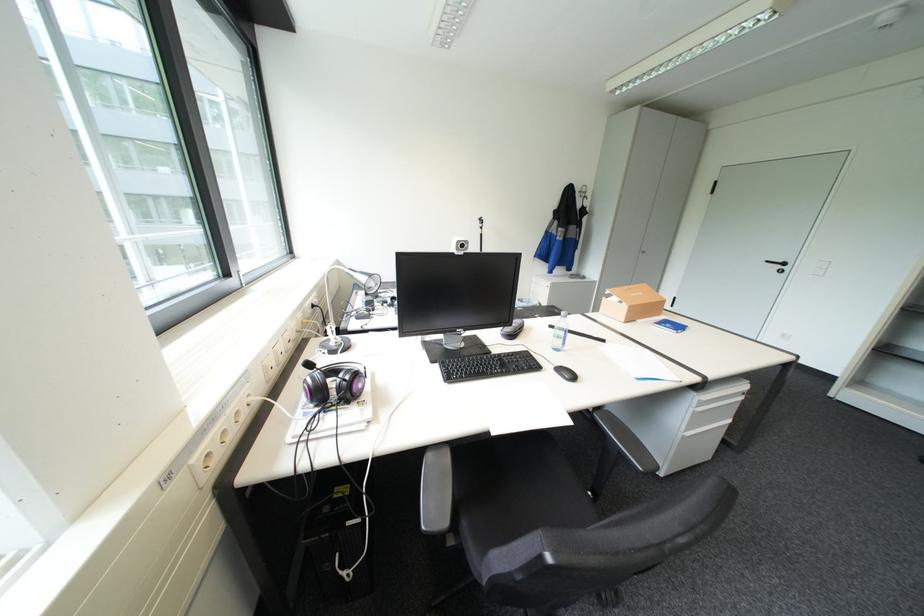
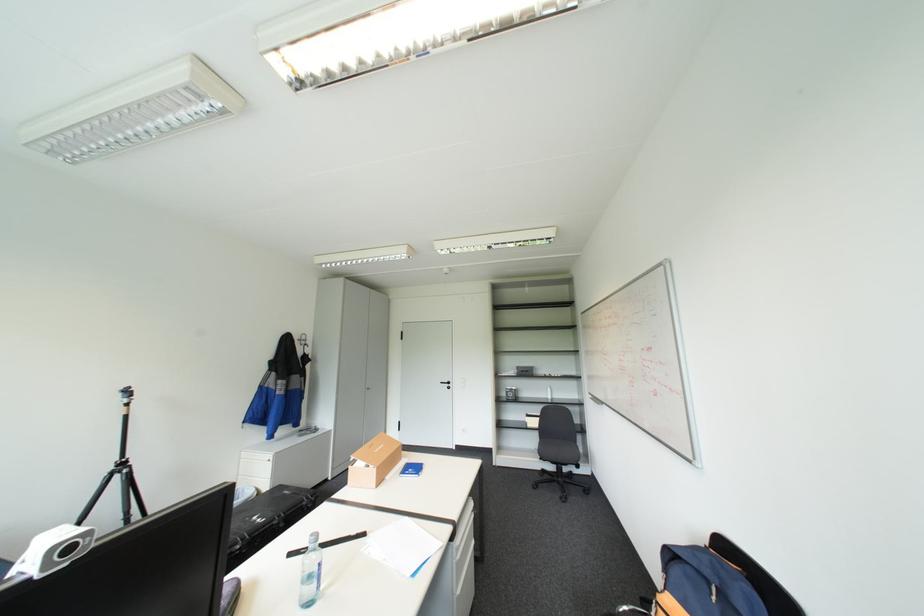
How did the camera likely rotate?

The rotation direction of the camera is right-up.